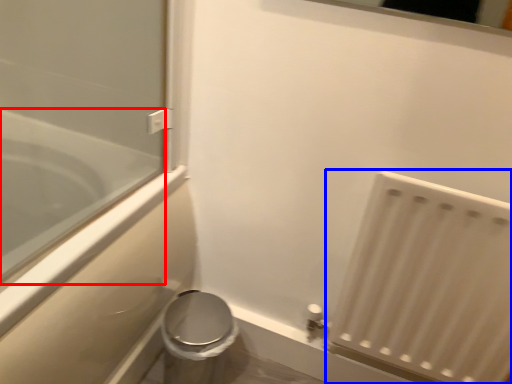
Question: Among these objects, which one is farthest to the camera, bathtub (highlighted by a red box) or radiator (highlighted by a blue box)?

Choices:
 (A) bathtub
 (B) radiator

Answer: (B)